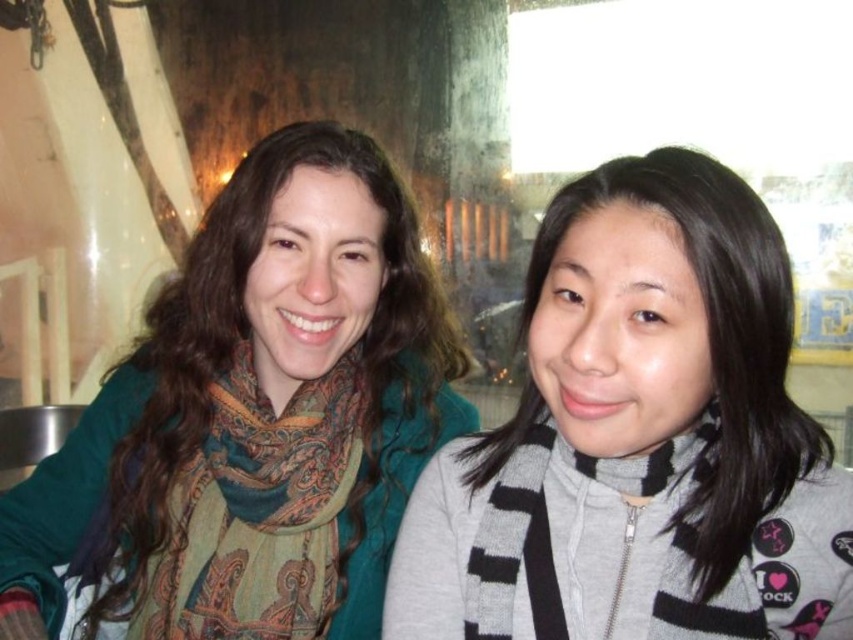
Between point (694, 262) and point (467, 568), which one is positioned in front?

Point (694, 262) is more forward.

Is gray striped scarf at center taller than gray/black striped scarf at right?

Indeed, gray striped scarf at center has a greater height compared to gray/black striped scarf at right.

You are a GUI agent. You are given a task and a screenshot of the screen. Output one action in this format:
    pyautogui.click(x=<x>, y=<y>)
    Task: Click on the gray striped scarf at center
    The width and height of the screenshot is (853, 640).
    Given the screenshot: What is the action you would take?
    pyautogui.click(x=639, y=440)

Find the location of a particular element. Image resolution: width=853 pixels, height=640 pixels. gray striped scarf at center is located at coordinates (639, 440).

Does point (350, 246) lie in front of point (474, 611)?

No, (350, 246) is behind (474, 611).

Between point (317, 445) and point (489, 621), which one is positioned in front?

Point (489, 621) is more forward.

At what (x,y) coordinates should I click in order to perform the action: click on paisley scarf at left. Please return your answer as a coordinate pair (x, y). Looking at the image, I should click on (251, 420).

Can you confirm if paisley scarf at left is positioned below paisley-patterned scarf at left?

No, paisley scarf at left is not below paisley-patterned scarf at left.

Which is behind, point (225, 477) or point (305, 593)?

Positioned behind is point (225, 477).

You are a GUI agent. You are given a task and a screenshot of the screen. Output one action in this format:
    pyautogui.click(x=<x>, y=<y>)
    Task: Click on the paisley scarf at left
    
    Given the screenshot: What is the action you would take?
    (251, 420)